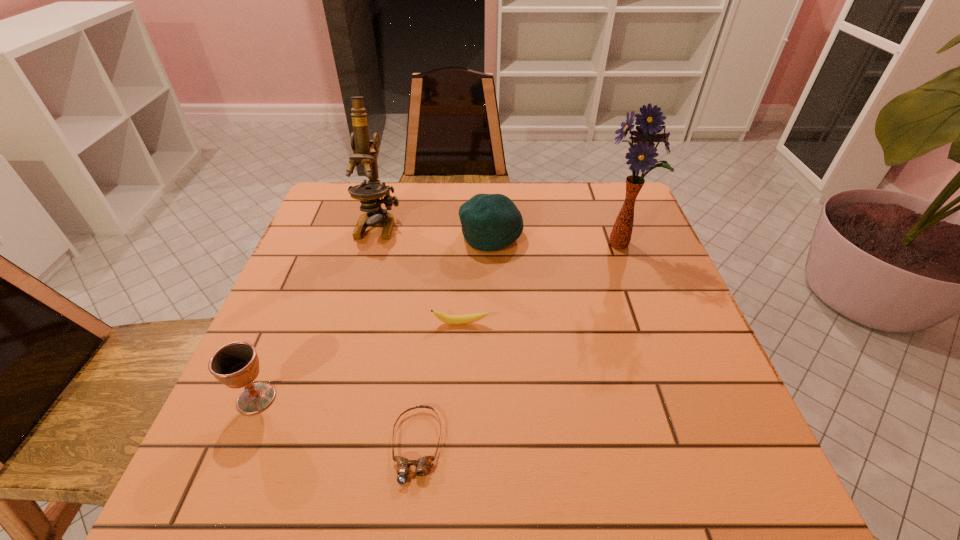
Find the location of a particular element. vacant space located on the back of the leftmost object is located at coordinates (309, 272).

This screenshot has height=540, width=960. I want to click on vacant position located 0.190m on the upward curve of the third nearest object, so click(457, 406).

Locate an element on the screen. The image size is (960, 540). flower arrangement located in the far edge section of the desktop is located at coordinates (641, 155).

This screenshot has height=540, width=960. I want to click on microscope present at the far edge, so click(x=369, y=194).

I want to click on beanie that is at the far edge, so click(x=490, y=222).

Identify the location of object located in the near edge section of the desktop. (422, 464).

Where is `microscope present at the left edge`? microscope present at the left edge is located at coordinates (369, 194).

You are a GUI agent. You are given a task and a screenshot of the screen. Output one action in this format:
    pyautogui.click(x=<x>, y=<y>)
    Task: Click on the chalice located in the left edge section of the desktop
    This screenshot has width=960, height=540.
    Given the screenshot: What is the action you would take?
    pyautogui.click(x=236, y=365)

You are a GUI agent. You are given a task and a screenshot of the screen. Output one action in this format:
    pyautogui.click(x=<x>, y=<y>)
    Task: Click on the object that is at the right edge
    This screenshot has height=540, width=960.
    Given the screenshot: What is the action you would take?
    pyautogui.click(x=641, y=155)

Locate an element on the screen. The height and width of the screenshot is (540, 960). object that is at the far left corner is located at coordinates (369, 194).